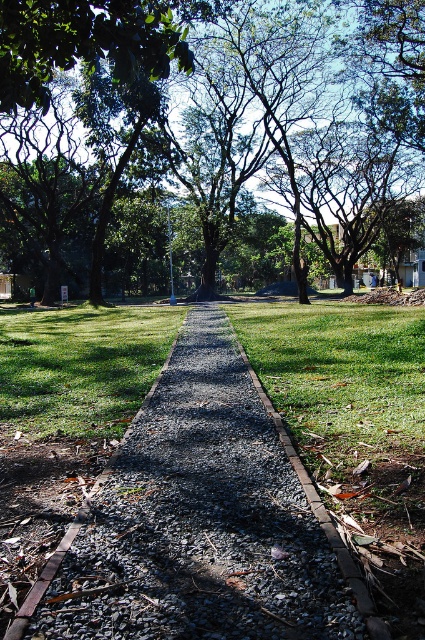
Question: Can you confirm if gray gravel at center is positioned to the right of green leafy tree at center?

Choices:
 (A) yes
 (B) no

Answer: (A)

Question: Which point appears closest to the camera in this image?

Choices:
 (A) (401, 8)
 (B) (294, 618)

Answer: (B)

Question: Is gray gravel at center smaller than green leafy tree at center?

Choices:
 (A) yes
 (B) no

Answer: (A)

Question: Which of the following is the closest to the observer?

Choices:
 (A) green leafy tree at center
 (B) gray gravel at center

Answer: (B)

Question: Can you confirm if gray gravel at center is positioned above green leafy tree at center?

Choices:
 (A) no
 (B) yes

Answer: (A)